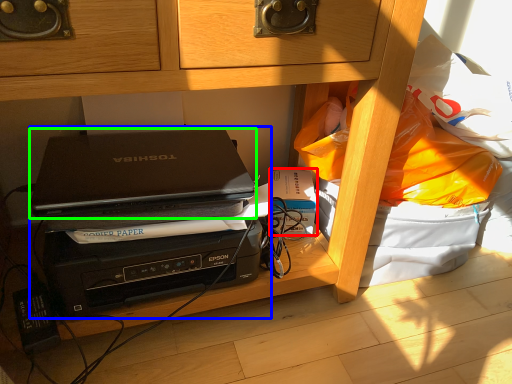
Question: Which object is the closest to the paperback book (highlighted by a red box)? Choose among these: computer (highlighted by a blue box) or laptop (highlighted by a green box).

Choices:
 (A) computer
 (B) laptop

Answer: (B)